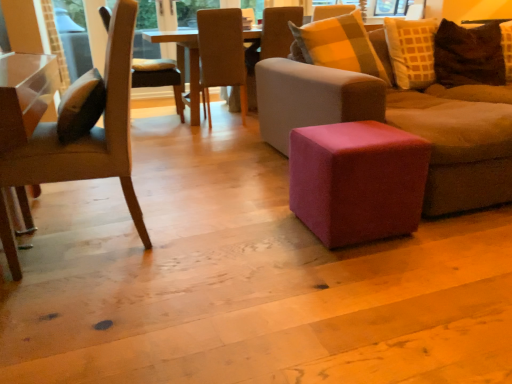
Question: From the image's perspective, is wooden chair at center, which is the fourth chair from front to back, located beneath brown textured pillow at upper right?

Choices:
 (A) yes
 (B) no

Answer: (B)

Question: Is wooden chair at center, which is the fourth chair from front to back, outside brown textured pillow at upper right?

Choices:
 (A) no
 (B) yes

Answer: (B)

Question: From a real-world perspective, is wooden chair at center, which is the fourth chair from front to back, physically below brown textured pillow at upper right?

Choices:
 (A) yes
 (B) no

Answer: (A)

Question: Is wooden chair at center, the first chair when ordered from back to front, smaller than brown textured pillow at upper right?

Choices:
 (A) no
 (B) yes

Answer: (A)

Question: Does wooden chair at center, the first chair when ordered from back to front, lie in front of brown textured pillow at upper right?

Choices:
 (A) yes
 (B) no

Answer: (B)

Question: Is beige fabric chair at center, acting as the 2th chair starting from the front, inside the boundaries of matte brown chair at left, which is counted as the 4th chair, starting from the back, or outside?

Choices:
 (A) inside
 (B) outside

Answer: (B)

Question: Is point (199, 16) closer or farther from the camera than point (1, 213)?

Choices:
 (A) closer
 (B) farther

Answer: (B)

Question: Is beige fabric chair at center, acting as the 3th chair starting from the back, to the left or to the right of matte brown chair at left, the first chair when ordered from front to back, in the image?

Choices:
 (A) left
 (B) right

Answer: (B)

Question: In the image, is beige fabric chair at center, acting as the 3th chair starting from the back, positioned in front of or behind matte brown chair at left, which is counted as the 4th chair, starting from the back?

Choices:
 (A) behind
 (B) front

Answer: (A)

Question: From a real-world perspective, is pink fabric stool at center physically located above or below matte brown chair at left, which is counted as the 4th chair, starting from the back?

Choices:
 (A) below
 (B) above

Answer: (A)

Question: From their relative heights in the image, would you say pink fabric stool at center is taller or shorter than matte brown chair at left, the first chair when ordered from front to back?

Choices:
 (A) short
 (B) tall

Answer: (A)

Question: Which is correct: pink fabric stool at center is inside matte brown chair at left, which is counted as the 4th chair, starting from the back, or outside of it?

Choices:
 (A) outside
 (B) inside

Answer: (A)

Question: Does point (411, 134) appear closer or farther from the camera than point (120, 117)?

Choices:
 (A) closer
 (B) farther

Answer: (B)

Question: From a real-world perspective, is matte brown chair at left, the first chair when ordered from front to back, physically located above or below pink fabric stool at center?

Choices:
 (A) above
 (B) below

Answer: (A)

Question: Is matte brown chair at left, the first chair when ordered from front to back, taller or shorter than pink fabric stool at center?

Choices:
 (A) short
 (B) tall

Answer: (B)